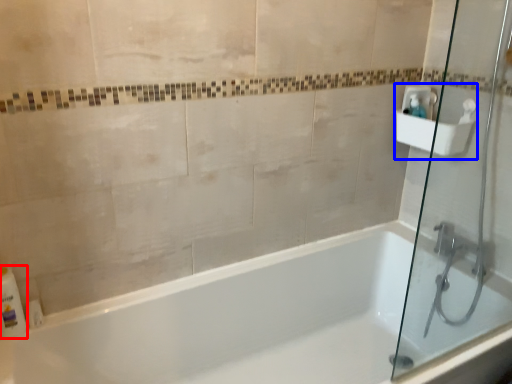
Question: Among these objects, which one is farthest to the camera, toiletry (highlighted by a red box) or sink (highlighted by a blue box)?

Choices:
 (A) toiletry
 (B) sink

Answer: (B)